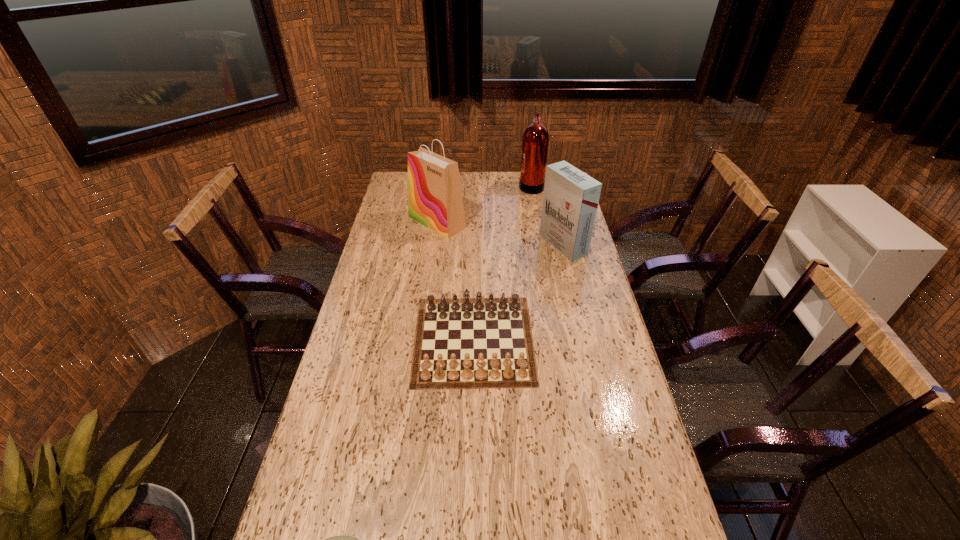
I want to click on vacant space that's between the fire extinguisher and the shopping bag, so click(x=484, y=204).

Where is `vacant space that is in between the third shortest object and the shopping bag`? The image size is (960, 540). vacant space that is in between the third shortest object and the shopping bag is located at coordinates (500, 233).

Find the location of a particular element. This screenshot has height=540, width=960. unoccupied area between the shopping bag and the cigarette case is located at coordinates (500, 233).

Find the location of a particular element. the fourth closest object relative to the cap is located at coordinates (535, 141).

Locate which object is the second closest to the fourth farthest object. Please provide its 2D coordinates. Your answer should be formatted as a tuple, i.e. [(x, y)], where the tuple contains the x and y coordinates of a point satisfying the conditions above.

[(435, 200)]

Where is `vacant space that satisfies the following two spatial constraints: 1. on the back side of the third shortest object; 2. on the front-facing side of the farthest object`? The width and height of the screenshot is (960, 540). vacant space that satisfies the following two spatial constraints: 1. on the back side of the third shortest object; 2. on the front-facing side of the farthest object is located at coordinates (549, 185).